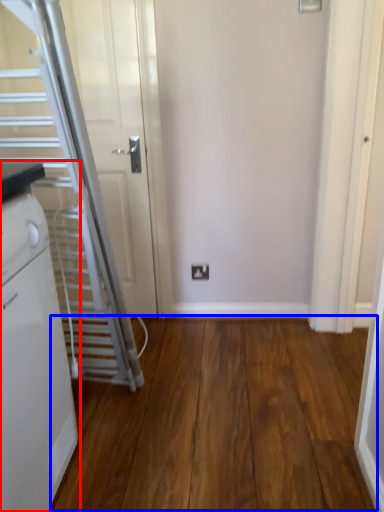
Question: Which object appears farthest to the camera in this image, home appliance (highlighted by a red box) or hardwood (highlighted by a blue box)?

Choices:
 (A) home appliance
 (B) hardwood

Answer: (B)